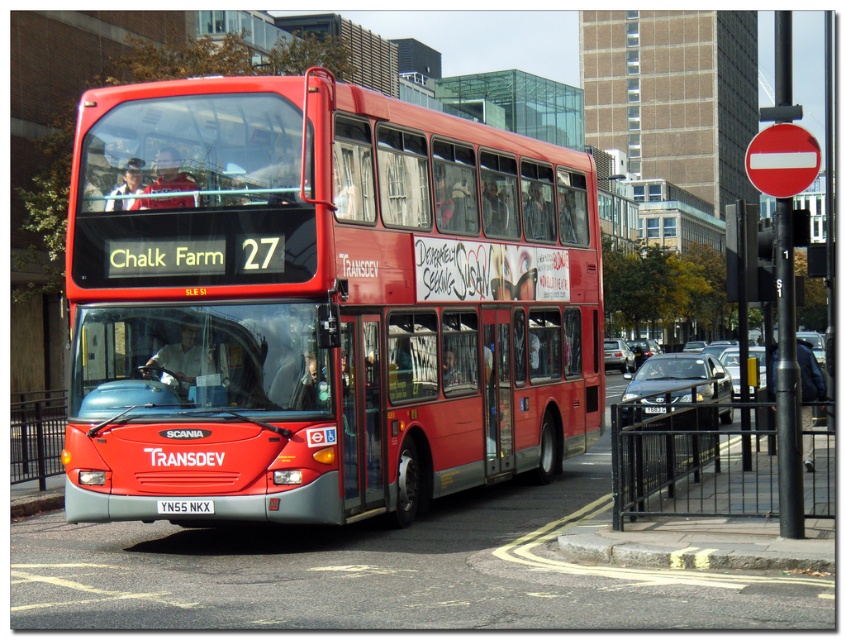
From the picture: Which is below, brown concrete curb at lower center or yellow metallic license plate at center?

brown concrete curb at lower center

Is brown concrete curb at lower center bigger than yellow metallic license plate at center?

Indeed, brown concrete curb at lower center has a larger size compared to yellow metallic license plate at center.

Is point (563, 540) positioned in front of point (198, 506)?

No, it is behind (198, 506).

At what (x,y) coordinates should I click in order to perform the action: click on brown concrete curb at lower center. Please return your answer as a coordinate pair (x, y). This screenshot has height=640, width=846. Looking at the image, I should click on (696, 548).

Which is more to the left, black metal fence at lower right or red plastic circle at upper right?

Positioned to the left is red plastic circle at upper right.

Where is `black metal fence at lower right`? Image resolution: width=846 pixels, height=640 pixels. black metal fence at lower right is located at coordinates (691, 460).

You are a GUI agent. You are given a task and a screenshot of the screen. Output one action in this format:
    pyautogui.click(x=<x>, y=<y>)
    Task: Click on the black metal fence at lower right
    
    Given the screenshot: What is the action you would take?
    pyautogui.click(x=691, y=460)

Is black metal fence at lower right further to camera compared to brown concrete curb at lower center?

Yes, it is behind brown concrete curb at lower center.

Between point (820, 458) and point (602, 545), which one is positioned behind?

Positioned behind is point (820, 458).

Locate an element on the screen. The width and height of the screenshot is (846, 640). black metal fence at lower right is located at coordinates (691, 460).